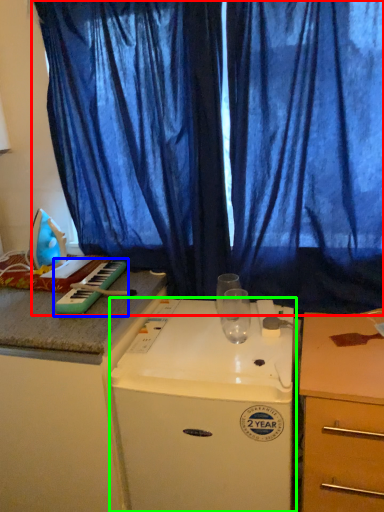
Question: Based on their relative distances, which object is nearer to curtain (highlighted by a red box)? Choose from musical keyboard (highlighted by a blue box) and home appliance (highlighted by a green box).

Choices:
 (A) musical keyboard
 (B) home appliance

Answer: (B)